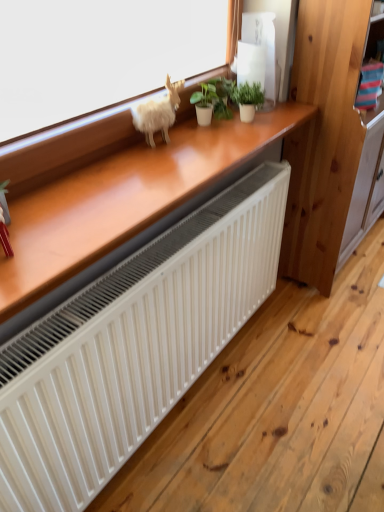
Question: Considering the relative sizes of fuzzy white animal at upper center and green matte plant at upper center, placed as the first houseplant when sorted from right to left, in the image provided, is fuzzy white animal at upper center thinner than green matte plant at upper center, placed as the first houseplant when sorted from right to left,?

Choices:
 (A) yes
 (B) no

Answer: (A)

Question: Can you confirm if fuzzy white animal at upper center is positioned to the left of green matte plant at upper center, placed as the first houseplant when sorted from right to left?

Choices:
 (A) no
 (B) yes

Answer: (B)

Question: Is fuzzy white animal at upper center positioned behind green matte plant at upper center, marked as the 2th houseplant in a left-to-right arrangement?

Choices:
 (A) no
 (B) yes

Answer: (A)

Question: Considering the relative sizes of fuzzy white animal at upper center and green matte plant at upper center, marked as the 2th houseplant in a left-to-right arrangement, in the image provided, is fuzzy white animal at upper center taller than green matte plant at upper center, marked as the 2th houseplant in a left-to-right arrangement,?

Choices:
 (A) no
 (B) yes

Answer: (B)

Question: Does fuzzy white animal at upper center appear on the right side of green matte plant at upper center, marked as the 2th houseplant in a left-to-right arrangement?

Choices:
 (A) no
 (B) yes

Answer: (A)

Question: In terms of width, does fuzzy white animal at upper center look wider or thinner when compared to wooden dresser at right?

Choices:
 (A) thin
 (B) wide

Answer: (A)

Question: Is point (157, 110) closer or farther from the camera than point (357, 204)?

Choices:
 (A) closer
 (B) farther

Answer: (A)

Question: From the image's perspective, is fuzzy white animal at upper center above or below wooden dresser at right?

Choices:
 (A) above
 (B) below

Answer: (B)

Question: From a real-world perspective, is fuzzy white animal at upper center above or below wooden dresser at right?

Choices:
 (A) below
 (B) above

Answer: (B)

Question: From the image's perspective, is green matte plant at upper center, marked as the 2th houseplant in a left-to-right arrangement, positioned above or below white matte radiator at lower center?

Choices:
 (A) above
 (B) below

Answer: (A)

Question: Is green matte plant at upper center, marked as the 2th houseplant in a left-to-right arrangement, spatially inside white matte radiator at lower center, or outside of it?

Choices:
 (A) outside
 (B) inside

Answer: (A)

Question: Would you say green matte plant at upper center, marked as the 2th houseplant in a left-to-right arrangement, is to the left or to the right of white matte radiator at lower center in the picture?

Choices:
 (A) left
 (B) right

Answer: (A)

Question: Relative to white matte radiator at lower center, is green matte plant at upper center, placed as the first houseplant when sorted from right to left, in front or behind?

Choices:
 (A) behind
 (B) front

Answer: (A)

Question: Which is correct: green matte plant at center, arranged as the first houseplant when viewed from the left, is inside white matte radiator at lower center, or outside of it?

Choices:
 (A) inside
 (B) outside

Answer: (B)

Question: From a real-world perspective, is green matte plant at center, arranged as the first houseplant when viewed from the left, above or below white matte radiator at lower center?

Choices:
 (A) below
 (B) above

Answer: (B)